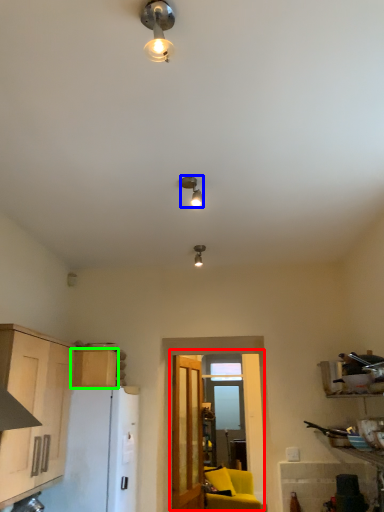
Question: Which object is positioned farthest from glass door (highlighted by a red box)? Select from lamp (highlighted by a blue box) and cabinetry (highlighted by a green box).

Choices:
 (A) lamp
 (B) cabinetry

Answer: (A)